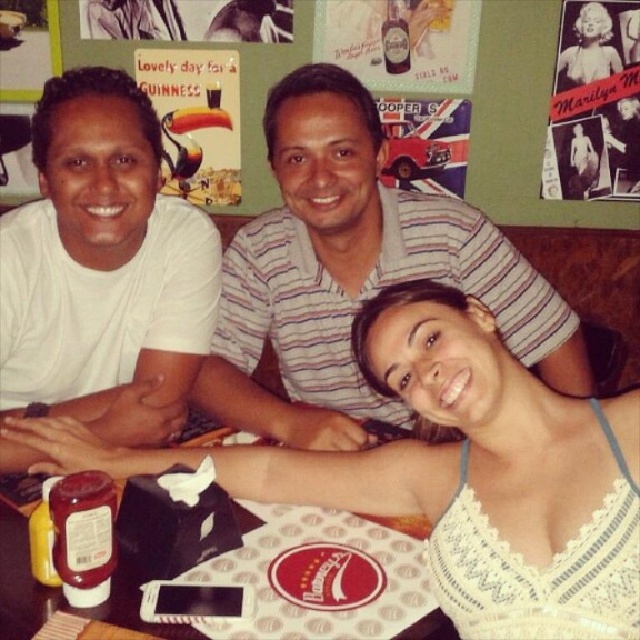
Which of these two, white matte shirt at upper left or vintage paper marilyn monroe poster at upper right, stands taller?

Standing taller between the two is white matte shirt at upper left.

Which is behind, point (77, 156) or point (636, 38)?

The point (636, 38) is behind.

Locate an element on the screen. The height and width of the screenshot is (640, 640). white matte shirt at upper left is located at coordinates (104, 268).

Which of these two, white striped shirt at center or white matte shirt at upper left, stands shorter?

white matte shirt at upper left

Can you confirm if white striped shirt at center is thinner than white matte shirt at upper left?

In fact, white striped shirt at center might be wider than white matte shirt at upper left.

Does point (458, 216) come in front of point (125, 291)?

No, it is behind (125, 291).

Image resolution: width=640 pixels, height=640 pixels. I want to click on white striped shirt at center, so click(x=355, y=273).

Between white lace tank top at center and white paper napkin at lower center, which one has less height?

Standing shorter between the two is white paper napkin at lower center.

Based on the photo, can you confirm if white lace tank top at center is taller than white paper napkin at lower center?

Indeed, white lace tank top at center has a greater height compared to white paper napkin at lower center.

Describe the element at coordinates (452, 472) in the screenshot. I see `white lace tank top at center` at that location.

What are the coordinates of `white lace tank top at center` in the screenshot? It's located at (452, 472).